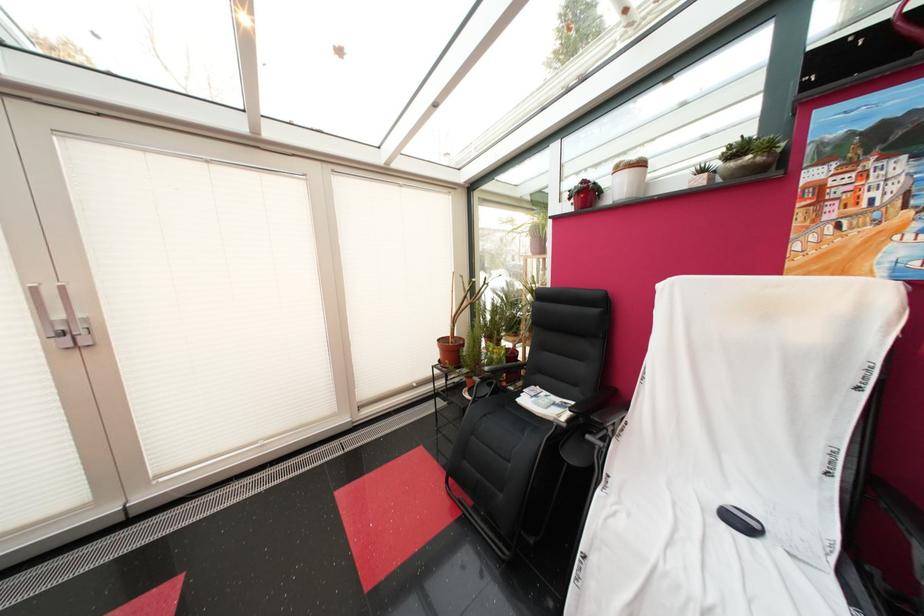
Image resolution: width=924 pixels, height=616 pixels. What do you see at coordinates (513, 415) in the screenshot?
I see `the chair sitting surface` at bounding box center [513, 415].